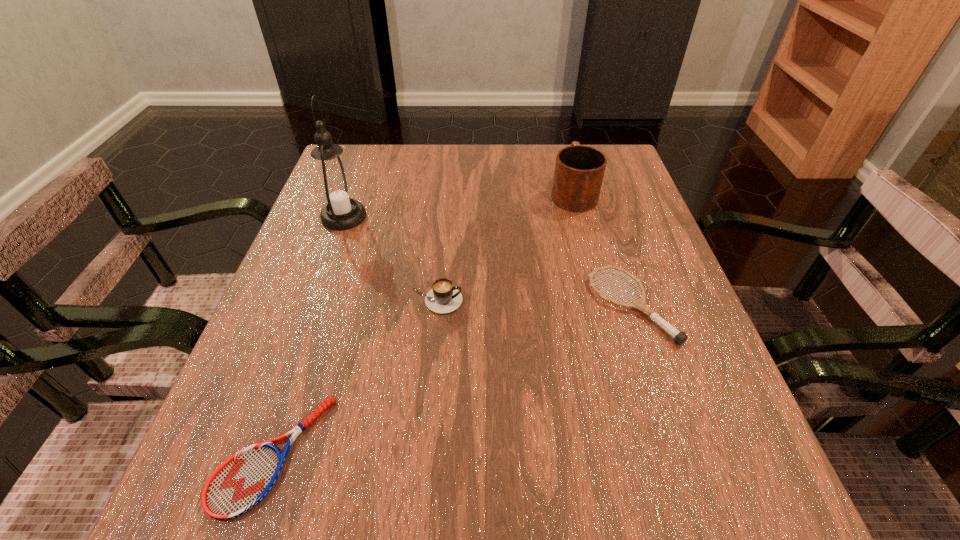
Where is `free space between the nearest object and the taller tennis racket`? free space between the nearest object and the taller tennis racket is located at coordinates (452, 380).

Find the location of a particular element. This screenshot has width=960, height=540. unoccupied area between the oil lamp and the fourth shortest object is located at coordinates (458, 205).

Image resolution: width=960 pixels, height=540 pixels. Find the location of `vacant point located between the fourth shortest object and the nearest object`. vacant point located between the fourth shortest object and the nearest object is located at coordinates (423, 323).

Where is `empty space between the fourth tallest object and the mug`? The image size is (960, 540). empty space between the fourth tallest object and the mug is located at coordinates (602, 249).

What are the coordinates of `free point between the fourth tallest object and the tallest object` in the screenshot? It's located at [x=488, y=261].

In order to click on empty space that is in between the nearest object and the mug in this screenshot , I will do `click(423, 323)`.

At what (x,y) coordinates should I click in order to perform the action: click on vacant area that lies between the mug and the oil lamp. Please return your answer as a coordinate pair (x, y). This screenshot has height=540, width=960. Looking at the image, I should click on (458, 205).

Locate which object ranks in proximity to the nearer tennis racket. Please provide its 2D coordinates. Your answer should be formatted as a tuple, i.e. [(x, y)], where the tuple contains the x and y coordinates of a point satisfying the conditions above.

[(443, 298)]

Point out which object is positioned as the second nearest to the fourth shortest object. Please provide its 2D coordinates. Your answer should be formatted as a tuple, i.e. [(x, y)], where the tuple contains the x and y coordinates of a point satisfying the conditions above.

[(443, 298)]

The image size is (960, 540). I want to click on free spot that satisfies the following two spatial constraints: 1. with the handle on the side of the third object from right to left; 2. on the left side of the farther tennis racket, so click(x=436, y=306).